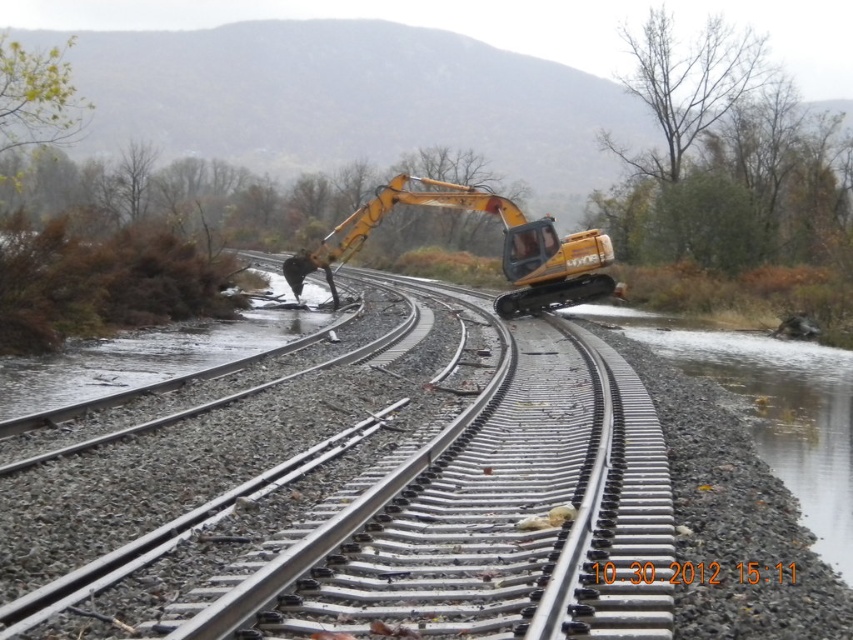
Which is above, clear water at bottom right or yellow rubber excavator at center?

yellow rubber excavator at center

Is clear water at bottom right further to the viewer compared to yellow rubber excavator at center?

No, it is not.

Describe the element at coordinates (772, 410) in the screenshot. I see `clear water at bottom right` at that location.

I want to click on clear water at bottom right, so click(x=772, y=410).

Can you confirm if metal train track at center is positioned above clear water at bottom right?

Indeed, metal train track at center is positioned over clear water at bottom right.

Does metal train track at center have a lesser width compared to clear water at bottom right?

Yes.

Identify the location of metal train track at center. (471, 516).

Can you confirm if metal train track at center is thinner than yellow rubber excavator at center?

Correct, metal train track at center's width is less than yellow rubber excavator at center's.

Measure the distance between point (546, 513) and camera.

Point (546, 513) is 6.86 meters from camera.

Locate an element on the screen. The image size is (853, 640). metal train track at center is located at coordinates (471, 516).